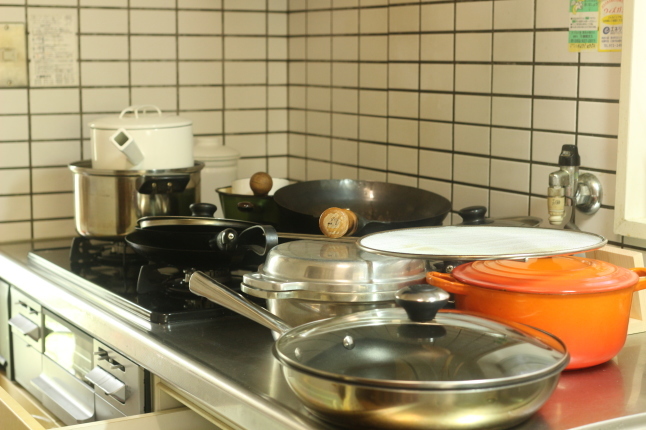
Locate an element on the screen. window is located at coordinates (634, 214).